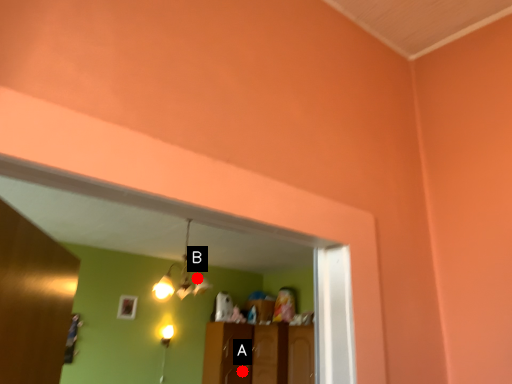
Question: Two points are circled on the image, labeled by A and B beside each circle. Which of the following is the farthest from the observer?

Choices:
 (A) A is further
 (B) B is further

Answer: (A)